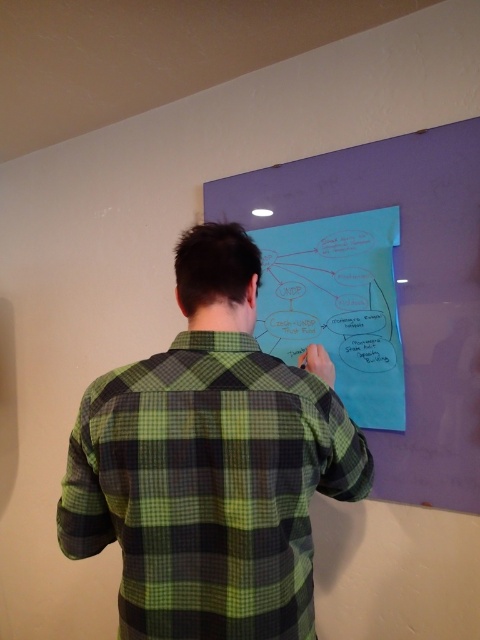
Is green plaid shirt at center to the right of blue paper at center from the viewer's perspective?

No, green plaid shirt at center is not to the right of blue paper at center.

Can you confirm if green plaid shirt at center is positioned above blue paper at center?

Incorrect, green plaid shirt at center is not positioned above blue paper at center.

Is point (242, 388) farther from viewer compared to point (351, 212)?

No, (242, 388) is closer to viewer.

At what (x,y) coordinates should I click in order to perform the action: click on green plaid shirt at center. Please return your answer as a coordinate pair (x, y). Looking at the image, I should click on (211, 465).

Can you confirm if green plaid shirt at center is shorter than blue paperboard at upper center?

Yes.

Can you confirm if green plaid shirt at center is bigger than blue paperboard at upper center?

Incorrect, green plaid shirt at center is not larger than blue paperboard at upper center.

Does point (202, 436) come behind point (282, 273)?

No, (202, 436) is closer to viewer.

Locate an element on the screen. This screenshot has height=640, width=480. green plaid shirt at center is located at coordinates (211, 465).

Identify the location of blue paperboard at upper center. (380, 294).

Is blue paperboard at upper center taller than blue paper at center?

Correct, blue paperboard at upper center is much taller as blue paper at center.

Is point (415, 266) positioned before point (379, 241)?

Yes, it is in front of point (379, 241).

Image resolution: width=480 pixels, height=640 pixels. I want to click on blue paperboard at upper center, so click(x=380, y=294).